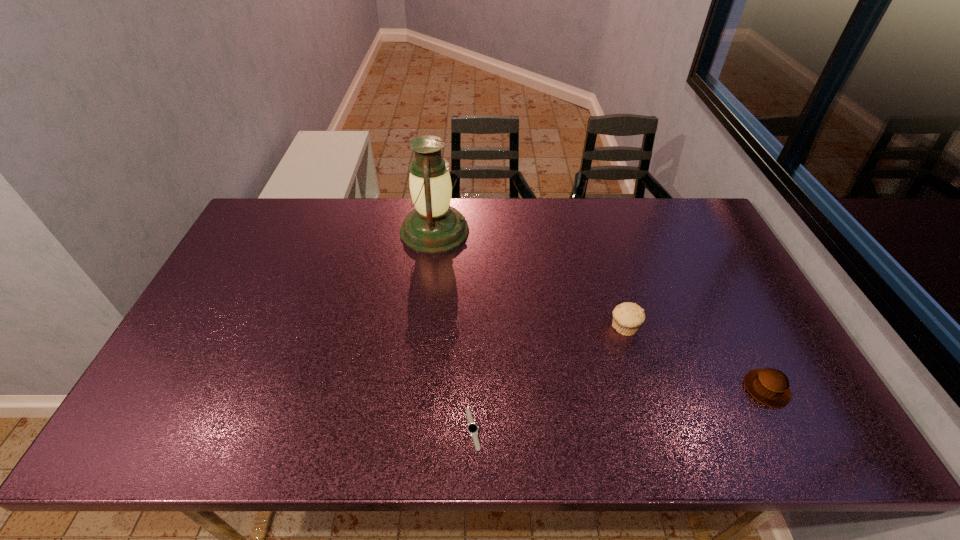
Identify the location of vacant space located 0.160m on the left of the right muffin. (680, 389).

This screenshot has width=960, height=540. I want to click on vacant space positioned on the right of the watch, so click(572, 429).

Locate an element on the screen. This screenshot has width=960, height=540. object that is at the far edge is located at coordinates (434, 226).

The width and height of the screenshot is (960, 540). I want to click on object present at the near edge, so click(x=472, y=428).

The image size is (960, 540). I want to click on object that is at the right edge, so click(x=769, y=386).

Find the location of a particular element. free space at the far edge of the desktop is located at coordinates (552, 225).

I want to click on vacant space at the left edge of the desktop, so click(x=207, y=355).

Where is `vacant area at the far right corner of the desktop`? This screenshot has width=960, height=540. vacant area at the far right corner of the desktop is located at coordinates [657, 209].

Identify the location of free space at the near right corner of the desktop. (792, 415).

Locate an element on the screen. This screenshot has height=540, width=960. free spot between the farthest object and the second farthest object is located at coordinates (529, 279).